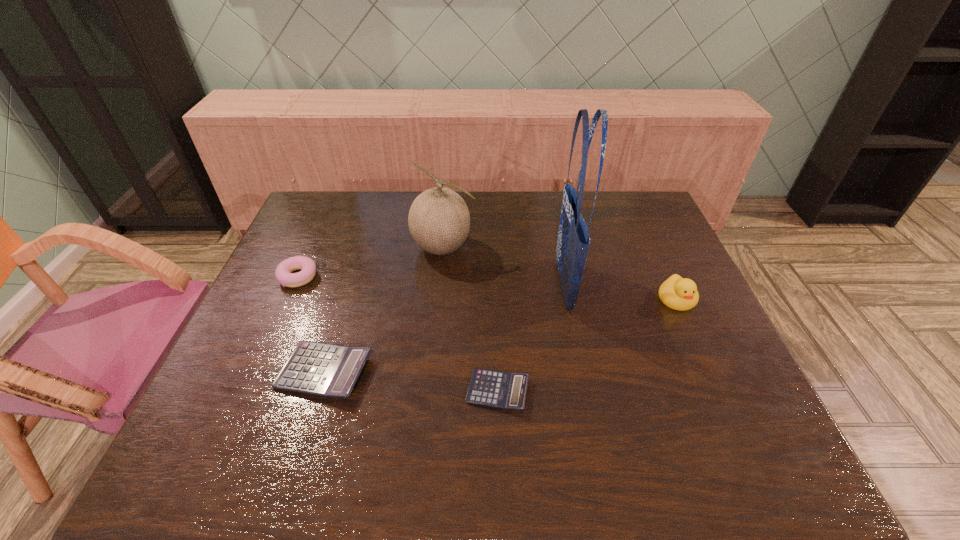
Image resolution: width=960 pixels, height=540 pixels. What are the coordinates of `free spot between the tallest object and the cantaloup` in the screenshot? It's located at (504, 266).

This screenshot has height=540, width=960. In order to click on free space between the tallest object and the fifth tallest object in this screenshot , I will do `click(444, 328)`.

Image resolution: width=960 pixels, height=540 pixels. I want to click on vacant space in between the tallest object and the fifth shortest object, so click(504, 266).

Where is `free space that is in between the doughnut and the shorter calculator`? Image resolution: width=960 pixels, height=540 pixels. free space that is in between the doughnut and the shorter calculator is located at coordinates (398, 334).

This screenshot has width=960, height=540. Find the location of `vacant area between the second tallest object and the taller calculator`. vacant area between the second tallest object and the taller calculator is located at coordinates (384, 309).

Identify which object is located as the nearest to the cantaloup. Please provide its 2D coordinates. Your answer should be formatted as a tuple, i.e. [(x, y)], where the tuple contains the x and y coordinates of a point satisfying the conditions above.

[(573, 241)]

Find the location of a particular element. the fifth closest object relative to the right calculator is located at coordinates (283, 273).